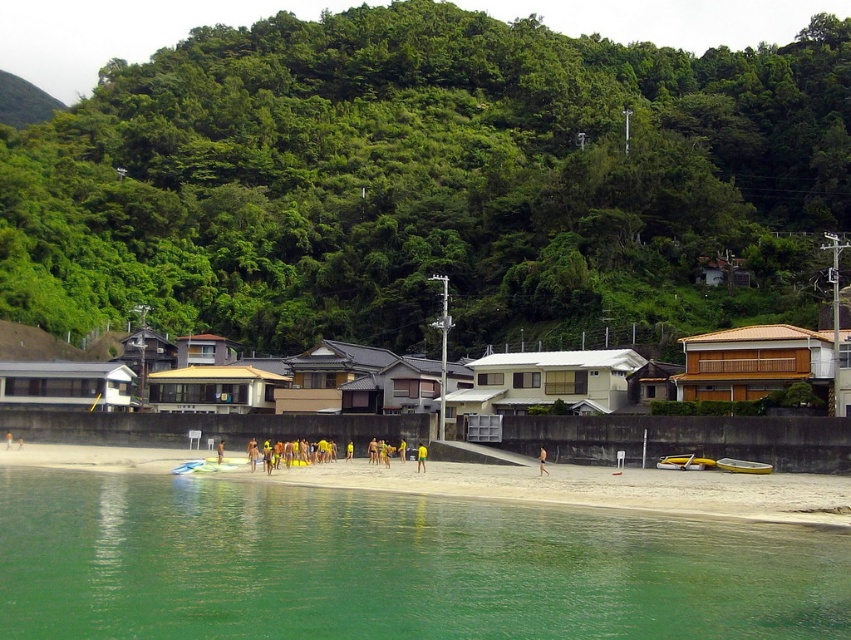
You are planning to build a small sandcastle on the beach. Given the sizes of the green translucent water at lower left and the white sand beach at lower center, which location would provide more space for your sandcastle?

The white sand beach at lower center provides more space for the sandcastle since it is larger than the green translucent water at lower left.